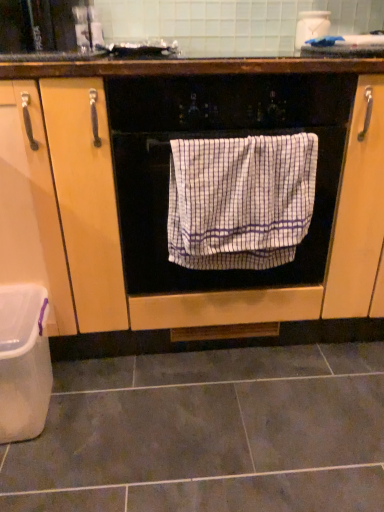
In order to click on vacant point above gray matte tile at lower center (from a real-world perspective) in this screenshot , I will do `click(175, 415)`.